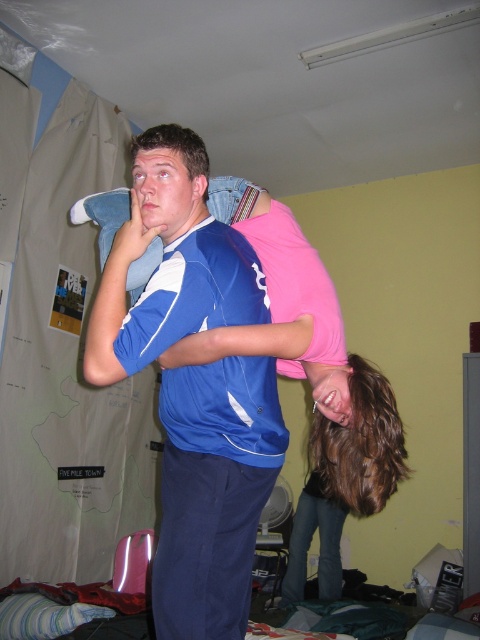
Does blue jersey at center appear under pink matte shirt at upper center?

Indeed, blue jersey at center is positioned under pink matte shirt at upper center.

Is blue jersey at center wider than pink matte shirt at upper center?

No.

Who is more distant from viewer, (x=194, y=388) or (x=384, y=444)?

The point (x=384, y=444) is behind.

At what (x,y) coordinates should I click in order to perform the action: click on blue jersey at center. Please return your answer as a coordinate pair (x, y). Image resolution: width=480 pixels, height=640 pixels. Looking at the image, I should click on (214, 493).